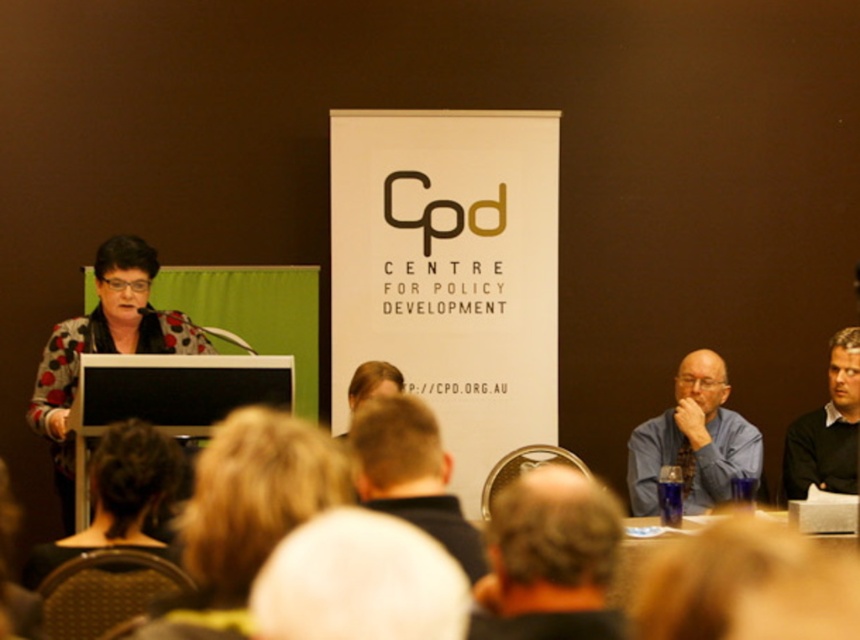
Question: Is polka dot sweater at left to the right of light brown hair at center from the viewer's perspective?

Choices:
 (A) yes
 (B) no

Answer: (B)

Question: Which object is closer to the camera taking this photo?

Choices:
 (A) dark green sweater at right
 (B) blonde hair at center

Answer: (B)

Question: Does blurred hair at center lie in front of dark green sweater at right?

Choices:
 (A) yes
 (B) no

Answer: (A)

Question: Can you confirm if polka dot sweater at left is positioned below matte black laptop at left?

Choices:
 (A) yes
 (B) no

Answer: (B)

Question: Which of the following is the closest to the observer?

Choices:
 (A) light brown hair at center
 (B) blonde hair at center

Answer: (B)

Question: Considering the real-world distances, which object is closest to the light brown hair at center?

Choices:
 (A) blue shirt at center
 (B) smooth beige head at center
 (C) blonde hair at center

Answer: (C)